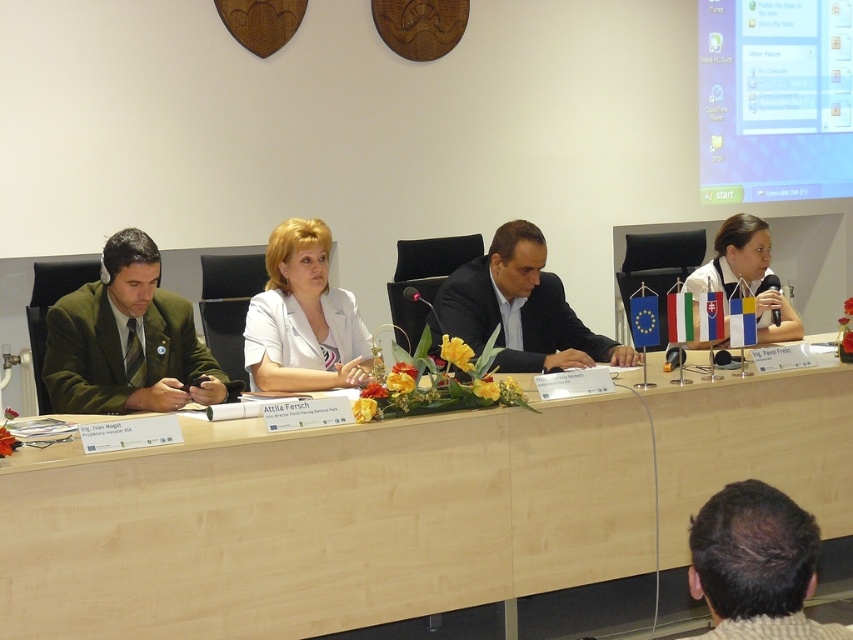
Based on the photo, you are a photographer standing at the back of the conference room. You need to capture a photo of the light wood table at center and dark brown hair at lower right in the same frame. Will both objects be fully visible in the photo?

The light wood table at center is taller than dark brown hair at lower right, so yes, both objects will be fully visible in the photo as the table will be above the hair.

You are a photographer adjusting your camera to focus on two specific points in the conference room scene. The first point is labeled as point [96,579] and the second is point [805,560]. Since you want to focus on the point closer to the camera, which point should you choose?

Point [96,579] is further to the camera than point [805,560], so you should choose point [96,579] to focus on since it is closer to the camera.

You are attending a virtual meeting and need to focus on the two points of interest marked as point (91, 396) and point (721, 502) in the conference room setup. Which point is closer to your camera view?

Point (91, 396) is closer to your camera view than point (721, 502) because it is further to the viewer.